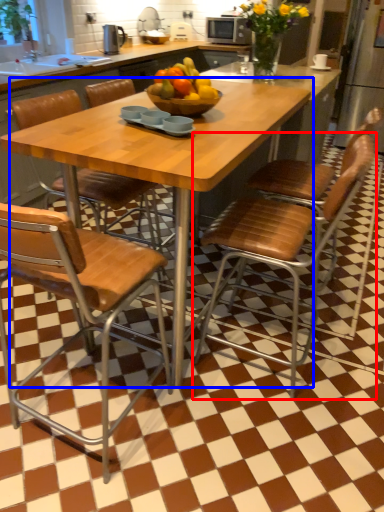
Question: Which point is further to the camera, chair (highlighted by a red box) or kitchen & dining room table (highlighted by a blue box)?

Choices:
 (A) chair
 (B) kitchen & dining room table

Answer: (A)